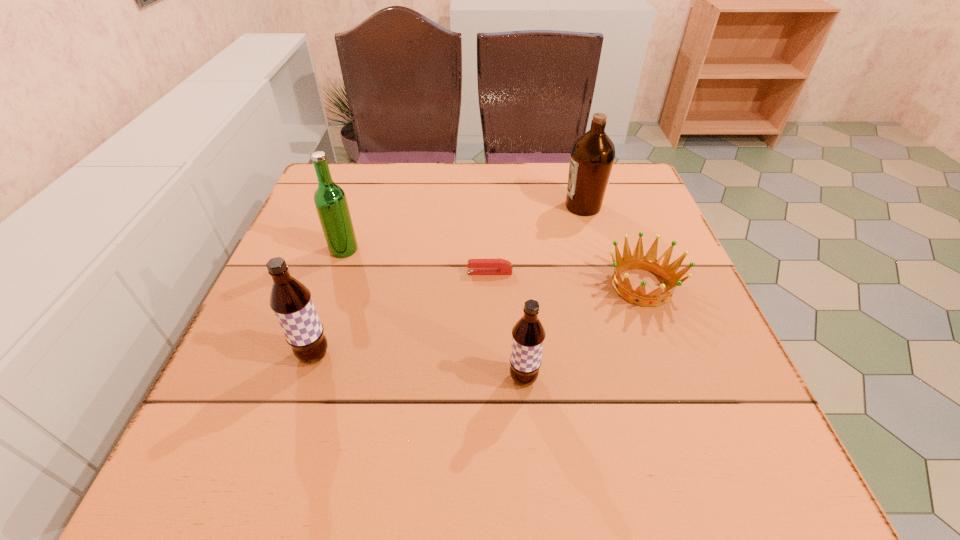
In order to click on vacant area that lies between the crown and the shortest object in this screenshot , I will do `click(565, 279)`.

Where is `free space between the stapler and the beer bottle`? The width and height of the screenshot is (960, 540). free space between the stapler and the beer bottle is located at coordinates (417, 261).

At what (x,y) coordinates should I click in order to perform the action: click on free space between the fifth tallest object and the farthest object. Please return your answer as a coordinate pair (x, y). The image size is (960, 540). Looking at the image, I should click on (612, 246).

This screenshot has height=540, width=960. Identify the location of free space between the beer bottle and the third shortest object. (434, 314).

Find the location of `vacant space in between the second shortest object and the left root beer`. vacant space in between the second shortest object and the left root beer is located at coordinates (478, 320).

Where is `free spot between the third shortest object and the crown`? The image size is (960, 540). free spot between the third shortest object and the crown is located at coordinates (583, 332).

Find the location of a particular element. The height and width of the screenshot is (540, 960). vacant region between the left root beer and the shortest object is located at coordinates [x=402, y=314].

Locate an element on the screen. vacant space that is in between the fifth tallest object and the farthest object is located at coordinates (612, 246).

Identify which object is the fourth closest to the crown. Please provide its 2D coordinates. Your answer should be formatted as a tuple, i.e. [(x, y)], where the tuple contains the x and y coordinates of a point satisfying the conditions above.

[(291, 301)]

Where is `object that stands as the fifth closest to the taller root beer`? object that stands as the fifth closest to the taller root beer is located at coordinates (592, 156).